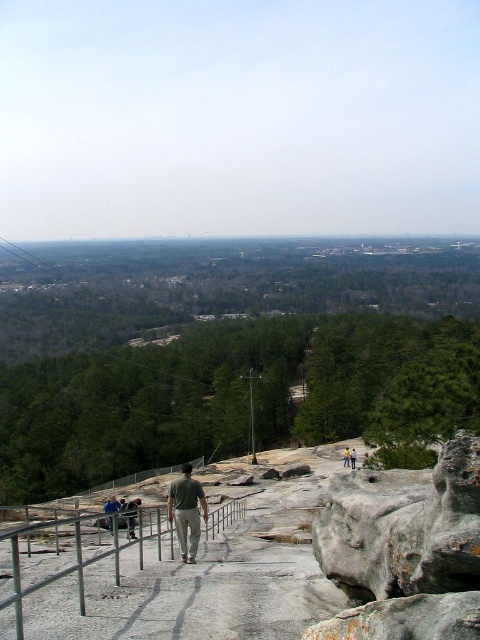
You are a photographer trying to capture a person wearing a green matte shirt at center and a light brown leather jacket at center. Since you want to emphasize their clothing, which item of clothing should you focus on to ensure it appears larger in your photo?

The green matte shirt at center has a greater height compared to the light brown leather jacket at center, so focusing on the green matte shirt at center will make it appear larger in the photo.